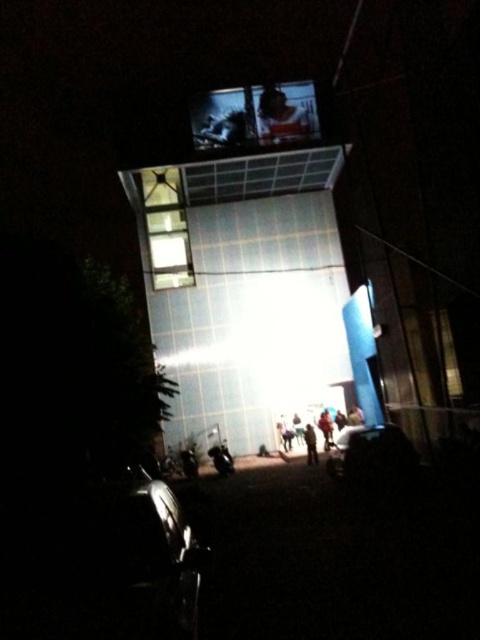
In the scene shown: Is blurred fabric person at center further to camera compared to light brown fabric pants at center?

No, blurred fabric person at center is closer to the viewer.

Is point (315, 442) less distant than point (321, 412)?

Yes, point (315, 442) is in front of point (321, 412).

Find the location of a particular element. blurred fabric person at center is located at coordinates (311, 444).